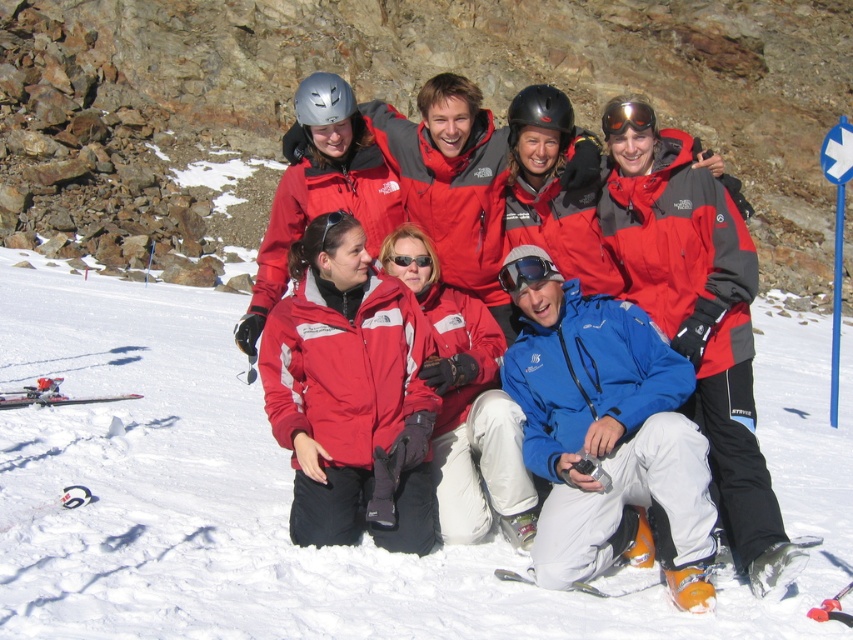
Question: Does matte blue goggles at center appear under orange reflective lens goggles at upper center?

Choices:
 (A) yes
 (B) no

Answer: (A)

Question: Which of these objects is positioned farthest from the white powder snow at center?

Choices:
 (A) matte red jacket at center
 (B) blue matte jacket at lower center
 (C) matte red ski jacket at center
 (D) matte blue goggles at center

Answer: (C)

Question: Considering the relative positions of blue matte jacket at lower center and orange reflective lens goggles at upper center in the image provided, where is blue matte jacket at lower center located with respect to orange reflective lens goggles at upper center?

Choices:
 (A) left
 (B) right

Answer: (A)

Question: Observing the image, what is the correct spatial positioning of matte red ski jacket at center in reference to orange reflective lens goggles at upper center?

Choices:
 (A) right
 (B) left

Answer: (A)

Question: Which object is closer to the camera taking this photo?

Choices:
 (A) matte blue goggles at center
 (B) matte red ski jacket at center
 (C) orange reflective lens goggles at upper center

Answer: (B)

Question: Which object is closer to the camera taking this photo?

Choices:
 (A) white powder snow at center
 (B) blue matte jacket at lower center
 (C) matte black skis at lower left

Answer: (A)